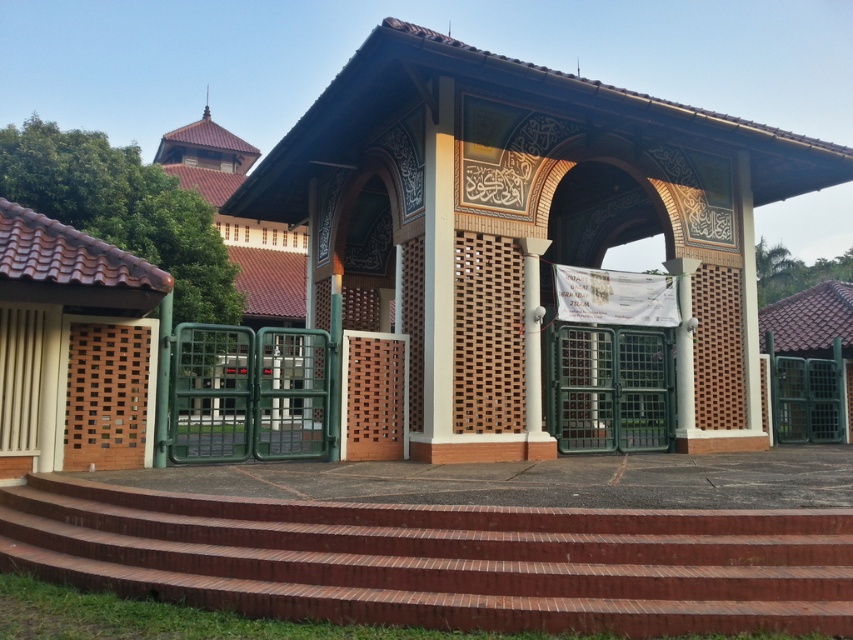
Measure the distance between brown textured gate at center and red brick stairs at center.

28.67 feet

Who is positioned more to the left, brown textured gate at center or red brick stairs at center?

red brick stairs at center is more to the left.

Where is `brown textured gate at center`? The height and width of the screenshot is (640, 853). brown textured gate at center is located at coordinates (523, 227).

Where is `brown textured gate at center`? brown textured gate at center is located at coordinates (523, 227).